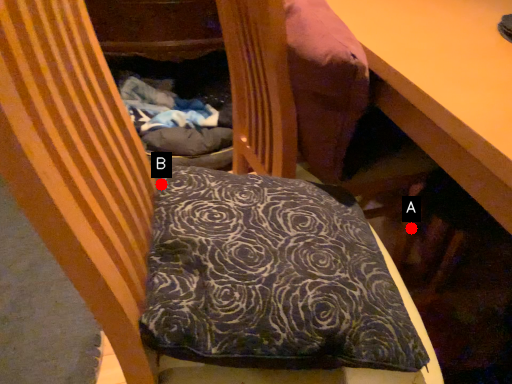
Question: Two points are circled on the image, labeled by A and B beside each circle. Which point appears farthest from the camera in this image?

Choices:
 (A) A is further
 (B) B is further

Answer: (A)